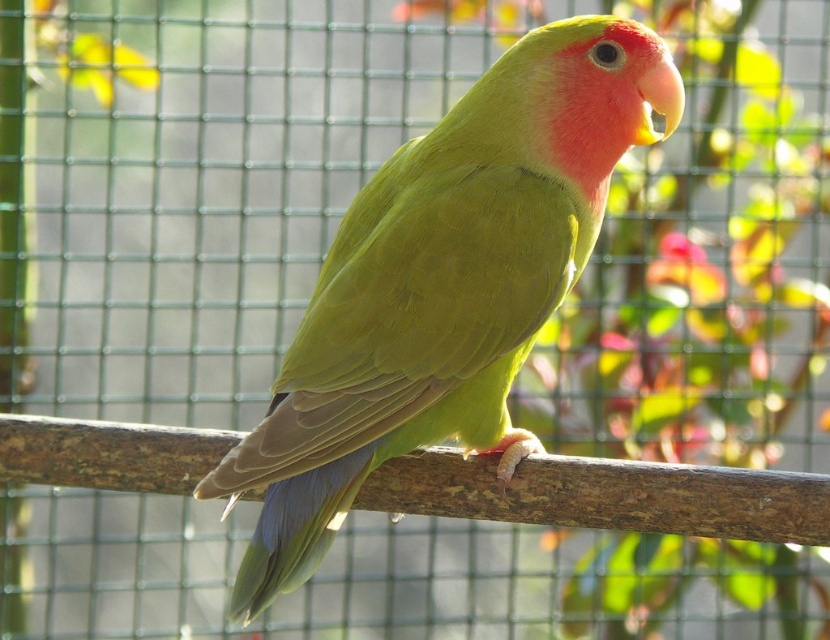
Question: Where is green matte parrot at center located in relation to brown wood at center in the image?

Choices:
 (A) below
 (B) above

Answer: (B)

Question: Can you confirm if green matte parrot at center is wider than brown wood at center?

Choices:
 (A) yes
 (B) no

Answer: (B)

Question: Among these objects, which one is farthest from the camera?

Choices:
 (A) green matte parrot at center
 (B) brown wood at center

Answer: (B)

Question: Among these objects, which one is nearest to the camera?

Choices:
 (A) green matte parrot at center
 (B) brown wood at center

Answer: (A)

Question: Is green matte parrot at center to the right of brown wood at center from the viewer's perspective?

Choices:
 (A) no
 (B) yes

Answer: (B)